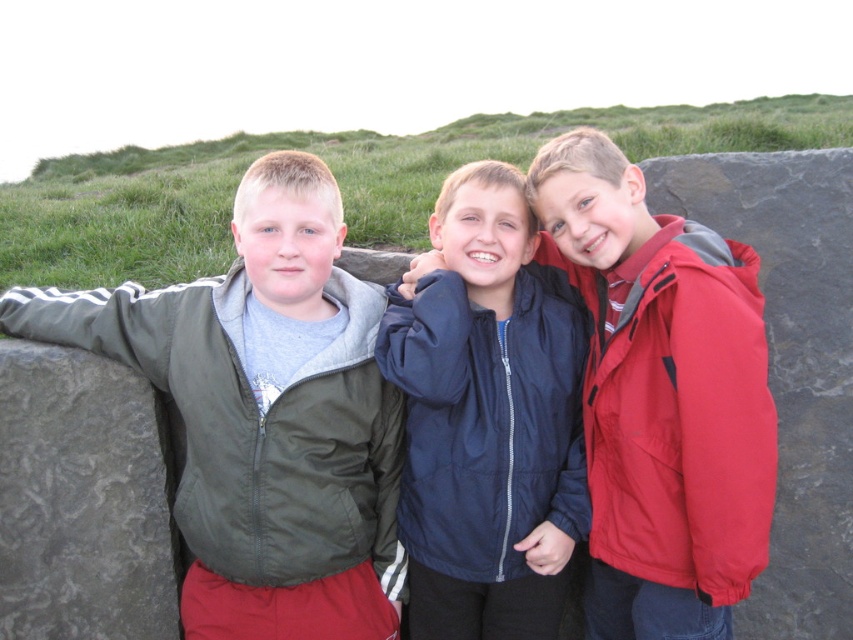
Consider the image. You are a photographer trying to capture a closeup of the boy on the left. You are currently positioned at point [231,182]. Do you need to move closer to point [573,232] to get a better shot?

Yes, you should move closer to point [573,232] because it is closer to the camera than point [231,182], allowing for a better closeup shot.

You are a photographer trying to capture the three boys standing against the stone wall. You want to ensure that the matte blue jacket at center is perfectly centered in your shot. Given its coordinates at point 0.619, 0.775, what adjustment should you make to the camera frame?

To center the matte blue jacket at center, adjust the camera frame so that its coordinates align with the center point of the image, which is typically at (x=426, y=320). Since the jacket is at (x=660, y=396), move the frame slightly to the left and upwards to bring it to the center.

You are a tailor trying to fit jackets for the boys. The matte blue jacket at center is currently too small for the boy in the middle. Can you determine if the matte green jacket at left would be a better fit based on their sizes?

The matte blue jacket at center is narrower than the matte green jacket at left, so the matte green jacket at left would provide a better fit for the boy in the middle if the current jacket is too small.